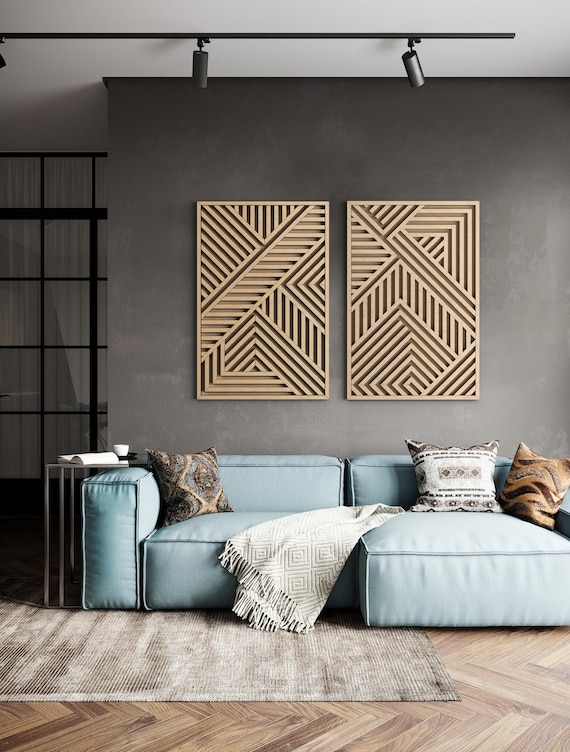
Identify the location of grid patio doors. This screenshot has width=570, height=752. (35, 317).